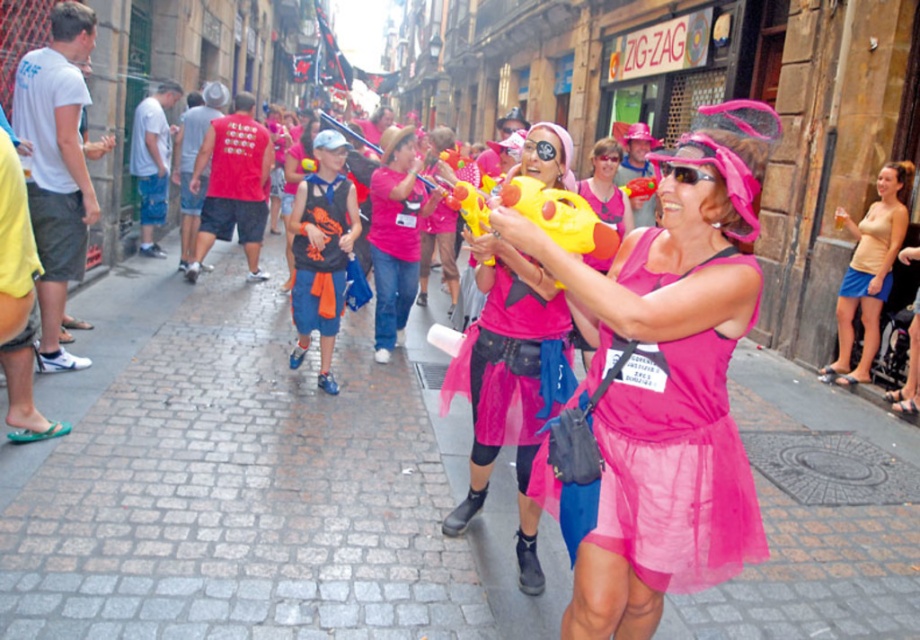
Who is higher up, matte pink tulle skirt at center or pink fabric toy gun at center?

pink fabric toy gun at center

Is point (510, 356) more distant than point (380, 179)?

That is False.

The width and height of the screenshot is (920, 640). In order to click on matte pink tulle skirt at center in this screenshot , I will do tap(509, 384).

Locate an element on the screen. The width and height of the screenshot is (920, 640). matte pink tulle skirt at center is located at coordinates (509, 384).

Who is more forward, [642,396] or [644,426]?

Point [644,426]

Which of these two, pink tulle dress at center or matte pink tulle dress at center, stands shorter?

matte pink tulle dress at center

Who is more forward, (677, 320) or (742, 532)?

Positioned in front is point (677, 320).

Locate an element on the screen. This screenshot has width=920, height=640. pink tulle dress at center is located at coordinates (661, 390).

What do you see at coordinates (661, 390) in the screenshot? The height and width of the screenshot is (640, 920). I see `pink tulle dress at center` at bounding box center [661, 390].

Which is behind, point (682, 310) or point (860, 246)?

Positioned behind is point (860, 246).

Find the location of a particular element. pink tulle dress at center is located at coordinates (661, 390).